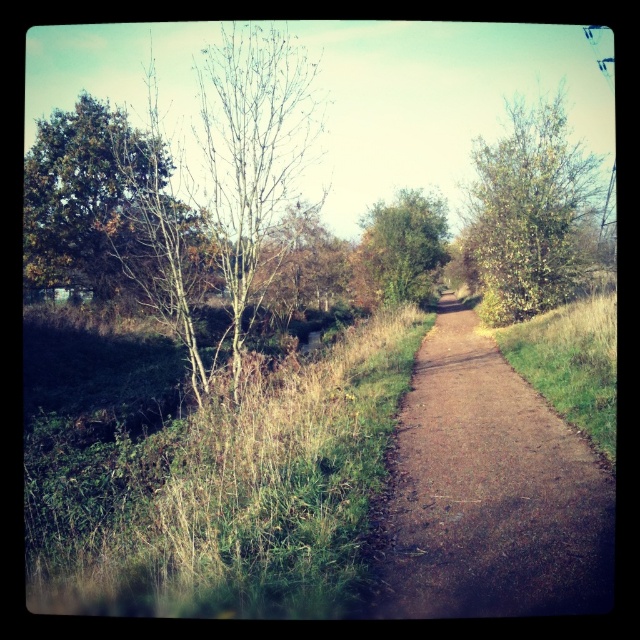
You are a hiker trying to follow the brown gravel path at center. There is a green leafy tree at upper right nearby. Which object takes up more space in the image?

The green leafy tree at upper right takes up more space in the image than the brown gravel path at center because the brown gravel path at center has a smaller size compared to green leafy tree at upper right.

You are a hiker walking along the narrow dirt path in the rural scene. You notice the green grass at right and the green leafy tree at center. Which object is positioned lower in the image?

The green grass at right is positioned lower than the green leafy tree at center in the image.

You are standing on the dirt path in the rural scene and want to walk towards the point that is closer to you. Which point should you head towards, point (595,324) or point (394,244)?

You should head towards point (595,324) because it is closer to the viewer than point (394,244).